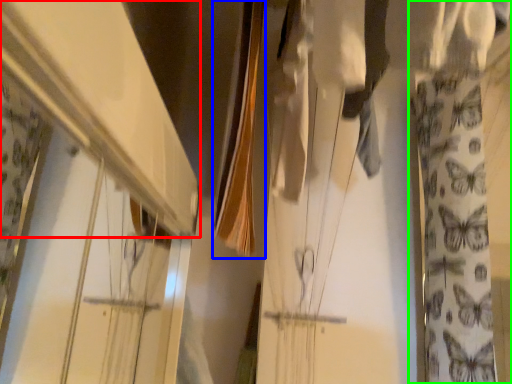
Question: Estimate the real-world distances between objects in this image. Which object is farther from shelf (highlighted by a red box), clothesline (highlighted by a blue box) or curtain (highlighted by a green box)?

Choices:
 (A) clothesline
 (B) curtain

Answer: (B)